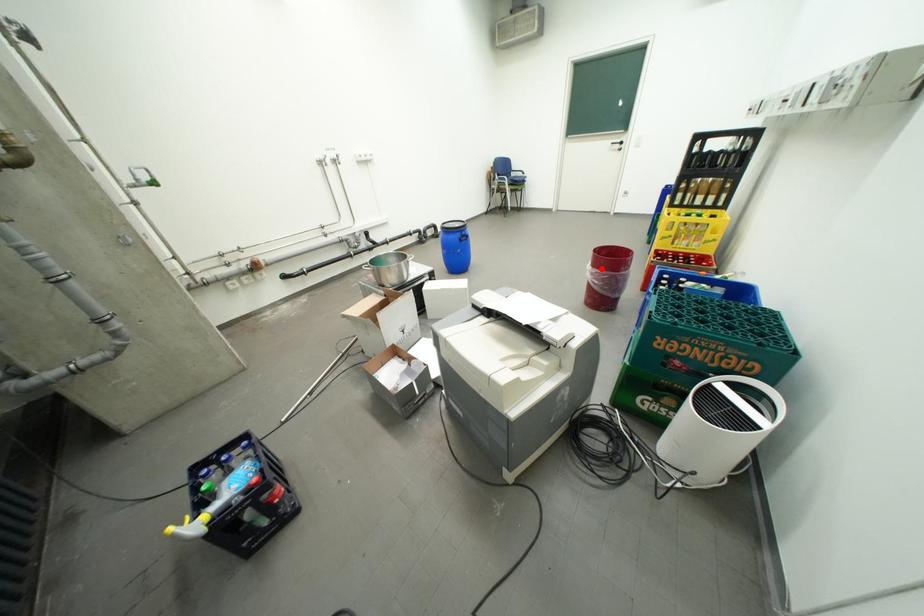
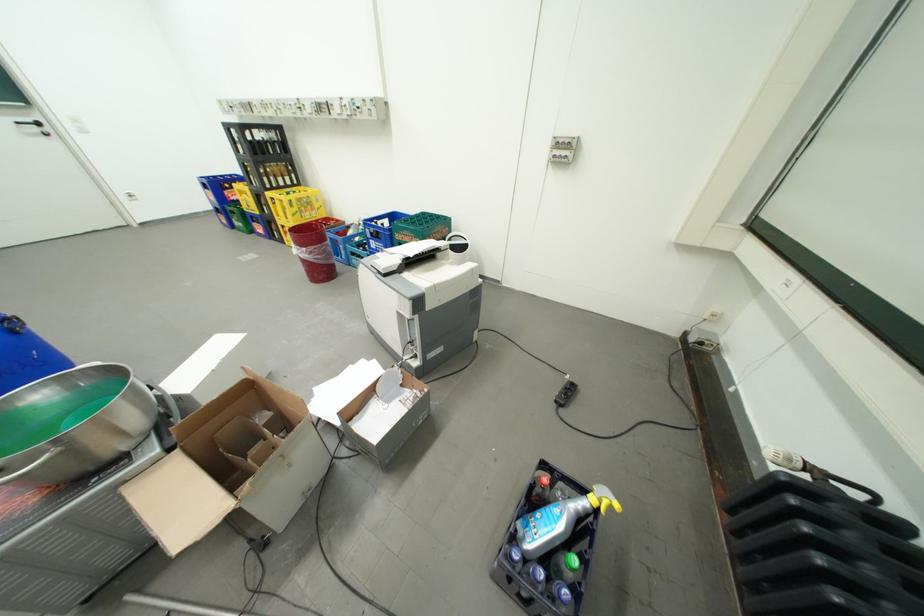
Question: I am providing you with two images of the same scene from different viewpoints. Image1 has a red point marked. In image2, the corresponding 3D location appears at what relative position? Reply with the corresponding letter.

Choices:
 (A) Closer
 (B) Farther

Answer: (A)